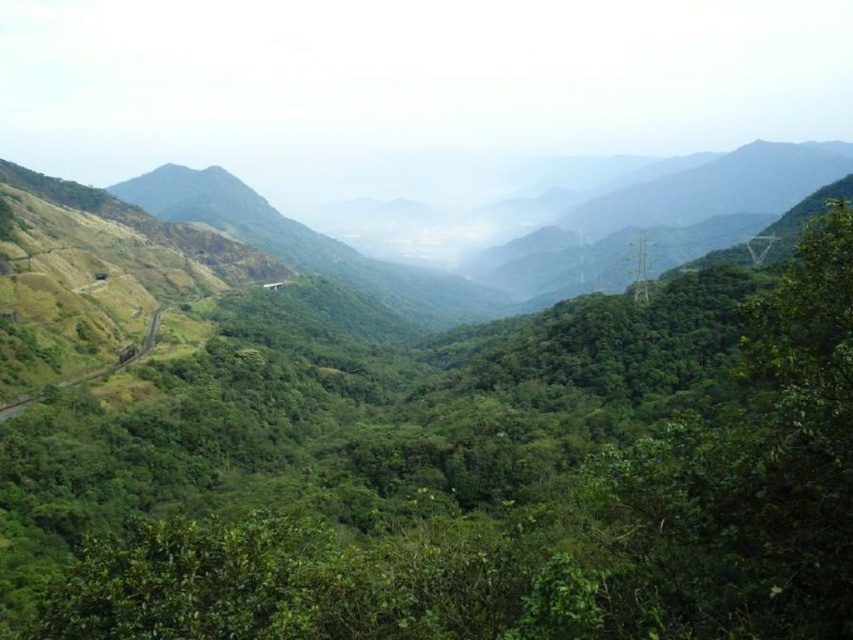
You are a hiker standing at the edge of the valley. You see the green leafy vegetation at center and the green grassy mountain path at left. Which one is nearer to you?

The green leafy vegetation at center is closer to the viewer than the green grassy mountain path at left.

You are hiking along the green grassy mountain path at left and want to reach the green leafy vegetation at center. Which direction should you head towards?

You should head to the right since the green leafy vegetation at center is to the right of the green grassy mountain path at left.